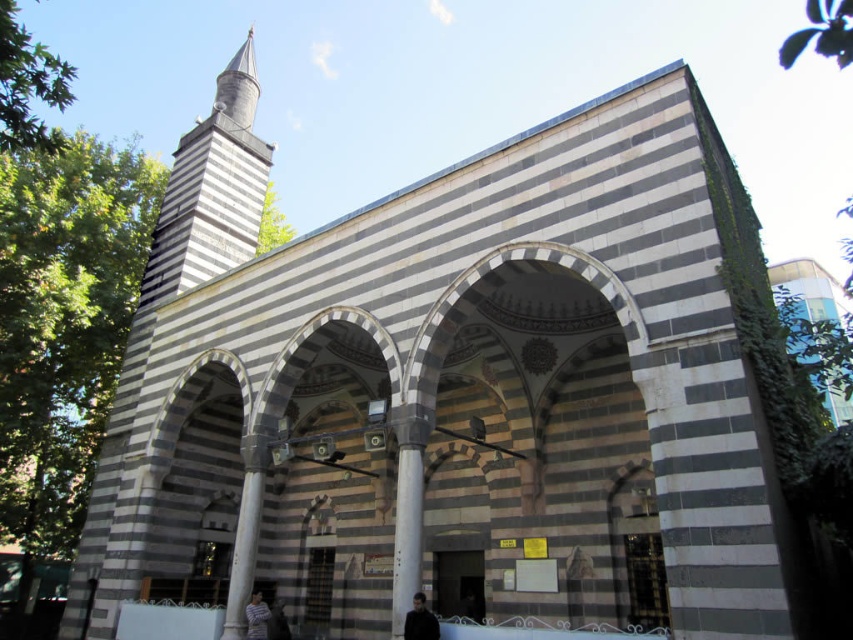
You are standing in front of the historical building and notice the gray stone minaret at upper left and the striped shirt at lower center. Which object is located higher up in the image?

The gray stone minaret at upper left is positioned over the striped shirt at lower center, so it is higher up in the image.

You are a tourist visiting the historical mosque and notice the gray stone minaret at upper left and the dark brown leather jacket at lower right. Which object is higher in the image?

The gray stone minaret at upper left is taller than the dark brown leather jacket at lower right.

Consider the image. You are a tourist visiting the historical mosque and notice the gray stone minaret at upper left and the striped shirt at lower center. Which object is taller?

The gray stone minaret at upper left is much taller than the striped shirt at lower center according to the description.